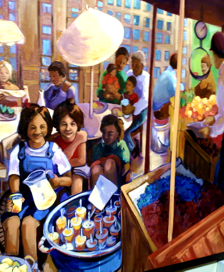
In order to click on pitcher of yellow liquid in this screenshot , I will do `click(39, 184)`, `click(44, 194)`, `click(44, 201)`.